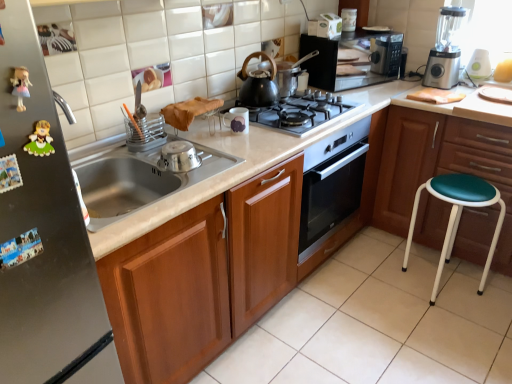
This screenshot has width=512, height=384. In order to click on free location in front of stainless steel bowl at sink, the first appliance viewed from the front in this screenshot , I will do `click(192, 189)`.